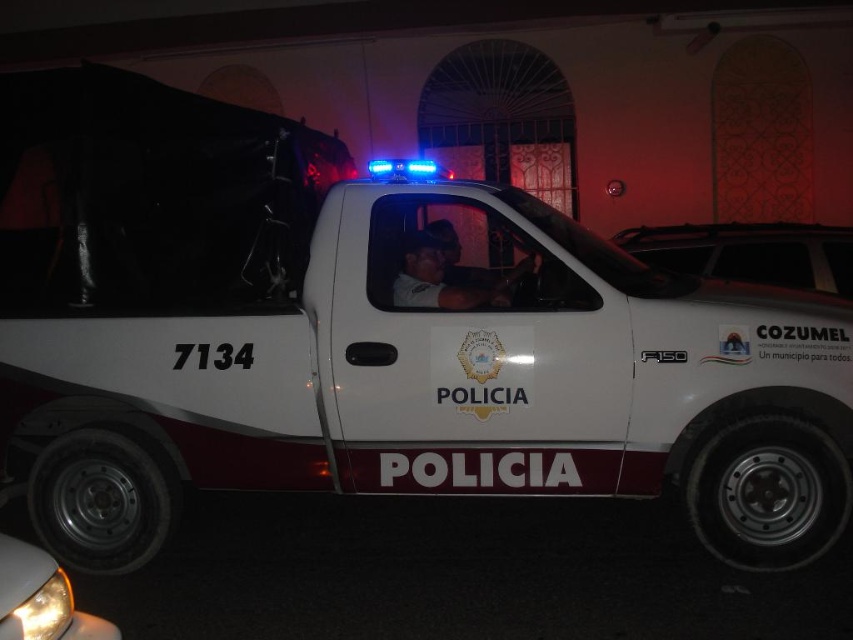
Is white matte windshield at upper center wider than yellow plastic headlight at lower left?

Yes.

Which is more to the left, white matte windshield at upper center or yellow plastic headlight at lower left?

yellow plastic headlight at lower left is more to the left.

Who is more forward, (778, 273) or (26, 579)?

Point (26, 579)

Identify the location of white matte windshield at upper center. (749, 252).

Does yellow plastic headlight at lower left appear on the left side of matte gray uniform at center?

Indeed, yellow plastic headlight at lower left is positioned on the left side of matte gray uniform at center.

In order to click on yellow plastic headlight at lower left in this screenshot , I will do `click(39, 598)`.

Between point (83, 637) and point (415, 280), which one is positioned in front?

Point (83, 637) is more forward.

Find the location of a particular element. yellow plastic headlight at lower left is located at coordinates (39, 598).

Does white matte windshield at upper center appear over matte gray uniform at center?

Indeed, white matte windshield at upper center is positioned over matte gray uniform at center.

Is white matte windshield at upper center taller than matte gray uniform at center?

Indeed, white matte windshield at upper center has a greater height compared to matte gray uniform at center.

Identify the location of white matte windshield at upper center. This screenshot has height=640, width=853. (749, 252).